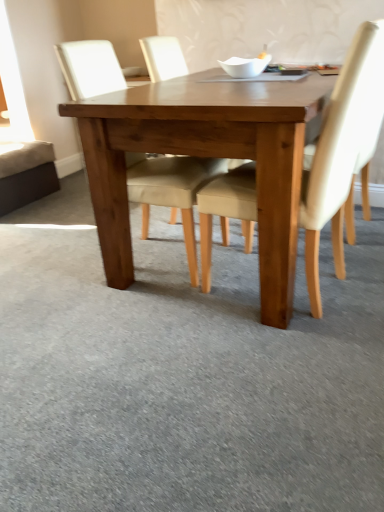
Question: Relative to beige fabric chair at center, which is the first chair in left-to-right order, is light beige fabric chair at center, the first chair when ordered from right to left, in front or behind?

Choices:
 (A) front
 (B) behind

Answer: (A)

Question: Considering the positions of light beige fabric chair at center, the first chair when ordered from right to left, and beige fabric chair at center, the second chair positioned from the right, in the image, is light beige fabric chair at center, the first chair when ordered from right to left, taller or shorter than beige fabric chair at center, the second chair positioned from the right,?

Choices:
 (A) short
 (B) tall

Answer: (A)

Question: Estimate the real-world distances between objects in this image. Which object is farther from the light beige fabric chair at center, the first chair when ordered from right to left?

Choices:
 (A) light brown wooden table at center
 (B) beige fabric chair at center, the second chair positioned from the right

Answer: (B)

Question: Which of these objects is positioned farthest from the beige fabric chair at center, the second chair positioned from the right?

Choices:
 (A) light brown wooden table at center
 (B) light beige fabric chair at center, positioned as the 2th chair in left-to-right order

Answer: (B)